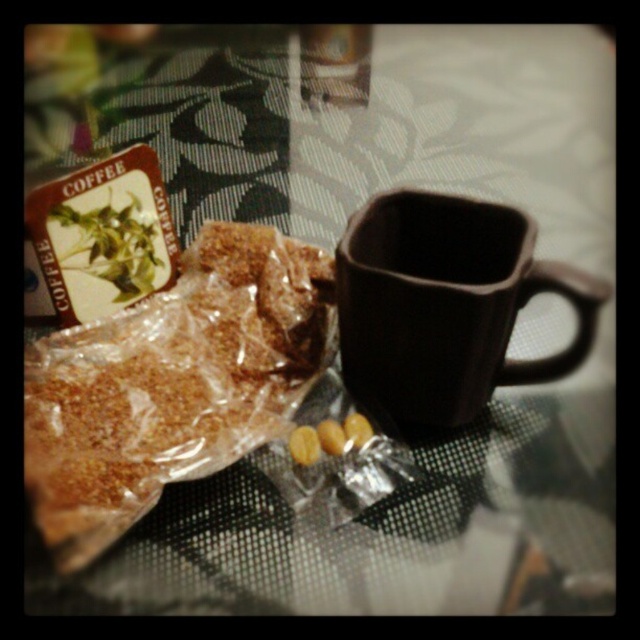
Does brown crumbly snack at center-left appear on the left side of matte brown mug at center?

Yes, brown crumbly snack at center-left is to the left of matte brown mug at center.

Does brown crumbly snack at center-left have a lesser height compared to matte brown mug at center?

Incorrect, brown crumbly snack at center-left's height does not fall short of matte brown mug at center's.

Does point (99, 428) come behind point (435, 246)?

That is False.

Find the location of a particular element. brown crumbly snack at center-left is located at coordinates (172, 384).